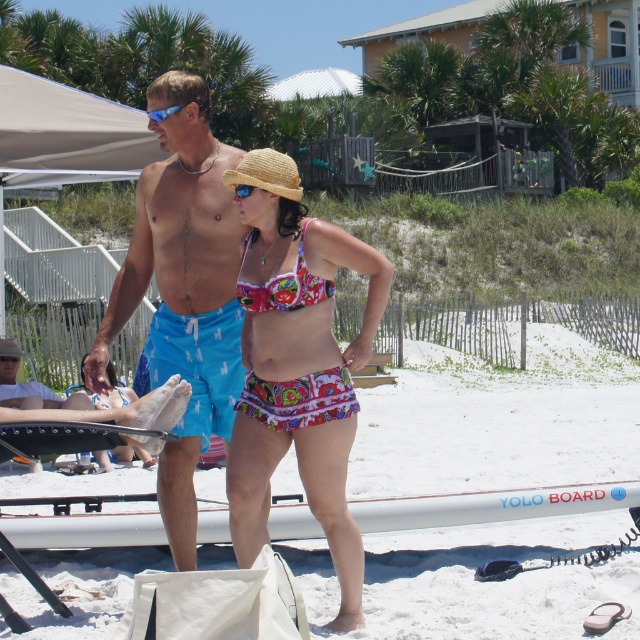
Question: Can you confirm if floral bikini at center is smaller than white plastic surfboard at center?

Choices:
 (A) yes
 (B) no

Answer: (B)

Question: Can you confirm if white plastic surfboard at center is thinner than printed fabric bikini at center?

Choices:
 (A) no
 (B) yes

Answer: (A)

Question: Which of these objects is positioned farthest from the blue reflective lens sunglasses at upper center?

Choices:
 (A) floral bikini at center
 (B) printed fabric bikini at center
 (C) floral fabric bikini top at center
 (D) blue printed shorts at center

Answer: (A)

Question: Estimate the real-world distances between objects in this image. Which object is farther from the printed fabric bikini at center?

Choices:
 (A) blue reflective lens sunglasses at upper center
 (B) blue plastic goggles at center
 (C) strawmaterial/texturehat at center
 (D) blue printed shorts at center

Answer: (A)

Question: Does floral fabric bikini top at center appear on the left side of blue plastic goggles at center?

Choices:
 (A) yes
 (B) no

Answer: (B)

Question: Which object appears farthest from the camera in this image?

Choices:
 (A) blue reflective lens sunglasses at upper center
 (B) blue printed shorts at center

Answer: (A)